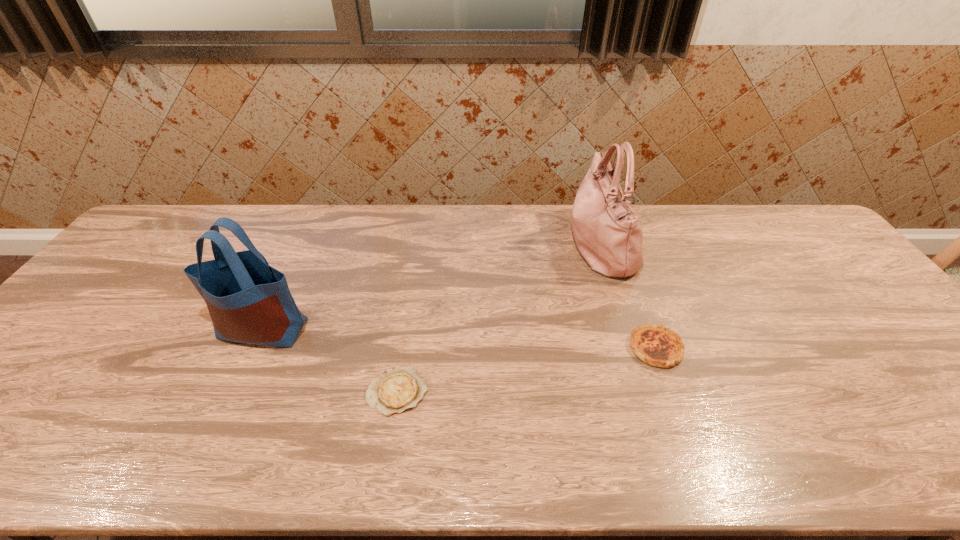
You are a GUI agent. You are given a task and a screenshot of the screen. Output one action in this format:
    pyautogui.click(x=<x>, y=<y>)
    Task: Click on the free space between the left quiche and the left handbag
    
    Given the screenshot: What is the action you would take?
    pyautogui.click(x=330, y=360)

Locate an element on the screen. The width and height of the screenshot is (960, 540). vacant space that's between the right quiche and the left handbag is located at coordinates (459, 339).

At what (x,y) coordinates should I click in order to perform the action: click on vacant area that lies between the third object from right to left and the right handbag. Please return your answer as a coordinate pair (x, y). The width and height of the screenshot is (960, 540). Looking at the image, I should click on (499, 318).

Locate an element on the screen. vacant space that is in between the shortest object and the second shortest object is located at coordinates (526, 370).

Locate an element on the screen. The image size is (960, 540). vacant space that is in between the left quiche and the farthest object is located at coordinates (499, 318).

The image size is (960, 540). In order to click on vacant area between the leftmost object and the taller quiche in this screenshot , I will do `click(459, 339)`.

The image size is (960, 540). Identify the location of free space between the leftmost object and the farthest object. (431, 286).

Where is `empty space between the leftmost object and the right handbag`? empty space between the leftmost object and the right handbag is located at coordinates (431, 286).

Find the location of a particular element. This screenshot has height=540, width=960. free space that is in between the second shortest object and the right handbag is located at coordinates (628, 296).

You are a GUI agent. You are given a task and a screenshot of the screen. Output one action in this format:
    pyautogui.click(x=<x>, y=<y>)
    Task: Click on the object that is the second closest one to the third tallest object
    Image resolution: width=960 pixels, height=540 pixels.
    Given the screenshot: What is the action you would take?
    pyautogui.click(x=398, y=389)